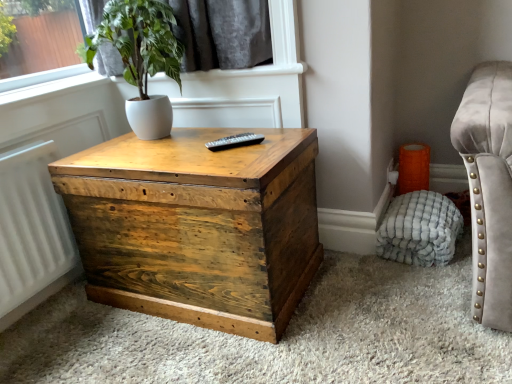
At what (x,y) coordinates should I click in order to perform the action: click on wooden trunk at center. Please return your answer as a coordinate pair (x, y). The image size is (512, 384). Looking at the image, I should click on (197, 227).

Identify the location of black plastic remote at center. (234, 141).

What do you see at coordinates (141, 58) in the screenshot? This screenshot has height=384, width=512. I see `white matte pot at upper left` at bounding box center [141, 58].

Where is `white textured pouf at lower right`? The image size is (512, 384). white textured pouf at lower right is located at coordinates (420, 229).

Between white textured pouf at lower right and white matte pot at upper left, which one has smaller width?

white textured pouf at lower right is thinner.

Find the location of a particular element. This screenshot has width=512, height=384. houseplant above the white textured pouf at lower right (from a real-world perspective) is located at coordinates (141, 58).

From the image's perspective, which is below, white textured pouf at lower right or white matte pot at upper left?

white textured pouf at lower right, from the image's perspective.

How much distance is there between white textured pouf at lower right and white matte pot at upper left?

white textured pouf at lower right and white matte pot at upper left are 3.78 feet apart from each other.

From a real-world perspective, which object stands above the other?

From a 3D spatial view, wooden trunk at center is above.

Is wooden trunk at center in front of or behind white textured pouf at lower right in the image?

wooden trunk at center is positioned closer to the viewer than white textured pouf at lower right.

Based on their positions, is wooden trunk at center located to the left or right of white textured pouf at lower right?

In the image, wooden trunk at center appears on the left side of white textured pouf at lower right.

Relative to white textured pouf at lower right, is white matte pot at upper left in front or behind?

white matte pot at upper left is in front of white textured pouf at lower right.

Is white matte pot at upper left turned away from white textured pouf at lower right?

No, white matte pot at upper left is not facing away from white textured pouf at lower right.

Is white matte pot at upper left far from white textured pouf at lower right?

Yes.

The height and width of the screenshot is (384, 512). I want to click on houseplant that appears on the left of white textured pouf at lower right, so click(x=141, y=58).

From the image's perspective, who appears lower, black plastic remote at center or white textured pouf at lower right?

white textured pouf at lower right.

Which object is positioned more to the right, black plastic remote at center or white textured pouf at lower right?

white textured pouf at lower right is more to the right.

Is black plastic remote at center oriented towards white textured pouf at lower right?

No, black plastic remote at center is not aimed at white textured pouf at lower right.

Considering the relative sizes of black plastic remote at center and white textured pouf at lower right in the image provided, is black plastic remote at center wider than white textured pouf at lower right?

In fact, black plastic remote at center might be narrower than white textured pouf at lower right.

Does black plastic remote at center have a lesser height compared to wooden trunk at center?

Yes, black plastic remote at center is shorter than wooden trunk at center.

Does black plastic remote at center have a lesser width compared to wooden trunk at center?

Yes, black plastic remote at center is thinner than wooden trunk at center.

Considering the relative positions of black plastic remote at center and wooden trunk at center in the image provided, is black plastic remote at center to the right of wooden trunk at center from the viewer's perspective?

Indeed, black plastic remote at center is positioned on the right side of wooden trunk at center.

Considering the positions of objects black plastic remote at center and wooden trunk at center in the image provided, who is in front, black plastic remote at center or wooden trunk at center?

Positioned in front is wooden trunk at center.

Is white matte pot at upper left to the right of black plastic remote at center from the viewer's perspective?

No, white matte pot at upper left is not to the right of black plastic remote at center.

Are white matte pot at upper left and black plastic remote at center making contact?

No, white matte pot at upper left is not with black plastic remote at center.

Is white matte pot at upper left behind black plastic remote at center?

No.

Considering the relative sizes of white matte pot at upper left and black plastic remote at center in the image provided, is white matte pot at upper left smaller than black plastic remote at center?

No, white matte pot at upper left is not smaller than black plastic remote at center.

From a real-world perspective, is wooden trunk at center over black plastic remote at center?

No.

This screenshot has height=384, width=512. I want to click on remote above the wooden trunk at center (from a real-world perspective), so click(234, 141).

Is wooden trunk at center not inside black plastic remote at center?

That's correct, wooden trunk at center is outside of black plastic remote at center.

Is wooden trunk at center positioned far away from black plastic remote at center?

No.

The height and width of the screenshot is (384, 512). Identify the location of houseplant on the left of white textured pouf at lower right. (141, 58).

The image size is (512, 384). I want to click on nightstand in front of the white textured pouf at lower right, so click(197, 227).

From the image, which object appears to be farther from wooden trunk at center, white textured pouf at lower right or white matte pot at upper left?

white textured pouf at lower right is positioned further to the anchor wooden trunk at center.

From the image, which object appears to be farther from white textured pouf at lower right, wooden trunk at center or white matte pot at upper left?

The object further to white textured pouf at lower right is white matte pot at upper left.

Considering their positions, is white matte pot at upper left positioned closer to white textured pouf at lower right than black plastic remote at center?

The object closer to white textured pouf at lower right is black plastic remote at center.

Estimate the real-world distances between objects in this image. Which object is closer to black plastic remote at center, wooden trunk at center or white textured pouf at lower right?

wooden trunk at center is positioned closer to the anchor black plastic remote at center.

Considering their positions, is wooden trunk at center positioned closer to white matte pot at upper left than black plastic remote at center?

Based on the image, black plastic remote at center appears to be nearer to white matte pot at upper left.

Which object lies nearer to the anchor point white matte pot at upper left, black plastic remote at center or white textured pouf at lower right?

black plastic remote at center is positioned closer to the anchor white matte pot at upper left.

From the image, which object appears to be nearer to wooden trunk at center, white textured pouf at lower right or black plastic remote at center?

black plastic remote at center is closer to wooden trunk at center.

Looking at the image, which one is located further to wooden trunk at center, black plastic remote at center or white matte pot at upper left?

white matte pot at upper left lies further to wooden trunk at center than the other object.

Identify the location of remote between white matte pot at upper left and wooden trunk at center in the vertical direction. This screenshot has height=384, width=512. (234, 141).

Identify the location of remote located between wooden trunk at center and white textured pouf at lower right in the left-right direction. The width and height of the screenshot is (512, 384). (234, 141).

I want to click on remote situated between white matte pot at upper left and white textured pouf at lower right from left to right, so click(234, 141).

The height and width of the screenshot is (384, 512). I want to click on nightstand between white matte pot at upper left and white textured pouf at lower right from left to right, so click(197, 227).